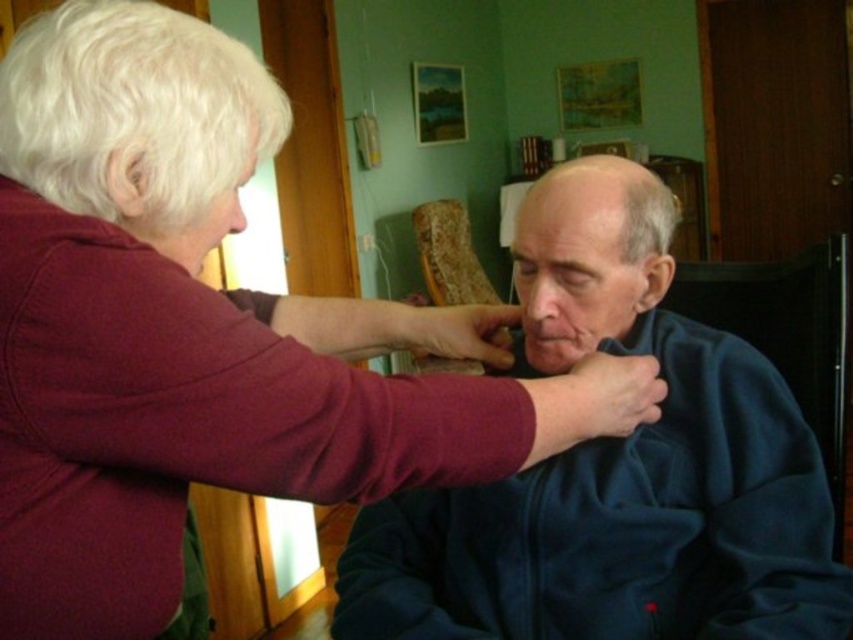
Question: Among these points, which one is nearest to the camera?

Choices:
 (A) (425, 490)
 (B) (415, 225)
 (C) (519, 211)
 (D) (10, 104)

Answer: (D)

Question: Can you confirm if white curly hair at upper left is positioned above smooth bald head at center?

Choices:
 (A) yes
 (B) no

Answer: (A)

Question: Observing the image, what is the correct spatial positioning of smooth bald head at center in reference to wooden textured chair at center?

Choices:
 (A) below
 (B) above

Answer: (A)

Question: Which point is farther to the camera?

Choices:
 (A) (459, 257)
 (B) (672, 492)
 (C) (93, 36)

Answer: (A)

Question: Can you confirm if white curly hair at upper left is positioned below wooden textured chair at center?

Choices:
 (A) yes
 (B) no

Answer: (A)

Question: Which object is farther from the camera taking this photo?

Choices:
 (A) dark blue fleece at center
 (B) white curly hair at upper left
 (C) wooden textured chair at center
 (D) smooth bald head at center

Answer: (C)